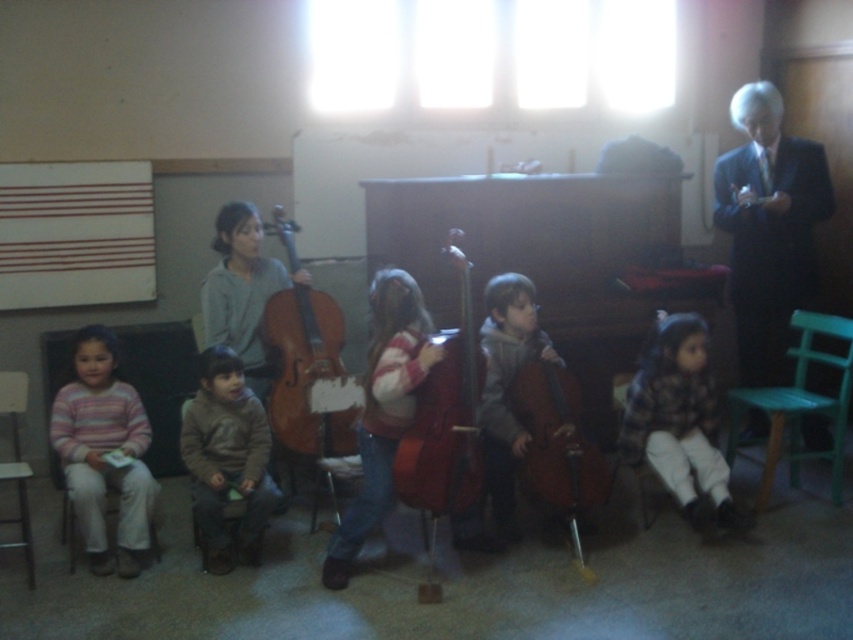
Question: Which of these objects is positioned farthest from the shiny brown cello at center?

Choices:
 (A) brown wooden cello at center
 (B) brown matte cello at center
 (C) brown fuzzy sweater at center
 (D) wooden chair at lower right

Answer: (D)

Question: Is fluffy brown coat at lower right wider than shiny brown cello at center?

Choices:
 (A) yes
 (B) no

Answer: (A)

Question: Can you confirm if dark suit at right is wider than shiny brown cello at center?

Choices:
 (A) no
 (B) yes

Answer: (B)

Question: Which object is farther from the camera taking this photo?

Choices:
 (A) dark suit at right
 (B) striped sweater at left
 (C) metallic silver chair at lower left
 (D) green plastic chair at lower right

Answer: (A)

Question: Can you confirm if brown matte cello at center is positioned to the right of wooden chair at lower right?

Choices:
 (A) no
 (B) yes

Answer: (A)

Question: Based on their relative distances, which object is nearer to the metallic silver chair at lower left?

Choices:
 (A) green plastic chair at lower right
 (B) brown matte cello at center
 (C) wooden chair at lower right
 (D) striped sweater at left

Answer: (D)